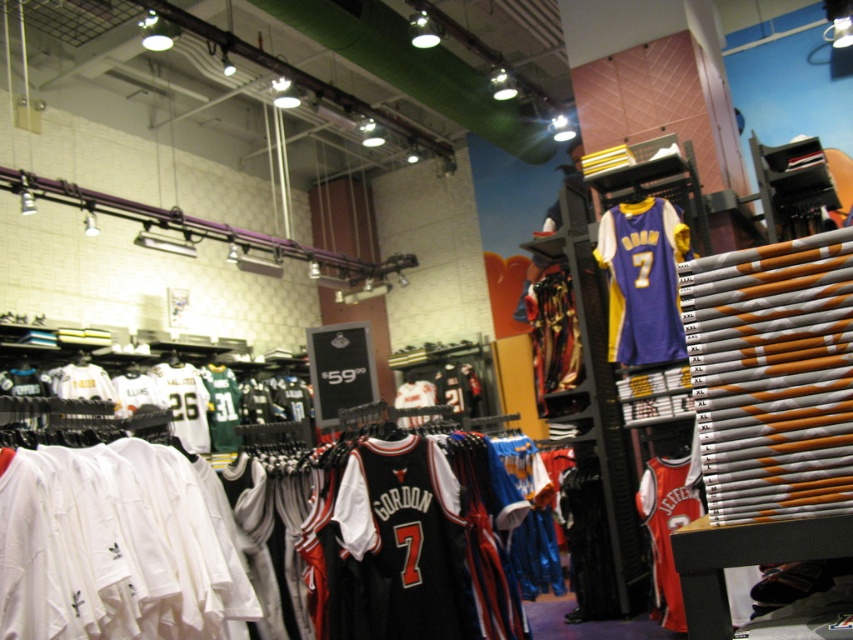
Does point (393, 442) come farther from viewer compared to point (698, 515)?

No, it is not.

Can you confirm if black jersey at center is bigger than red jersey at center?

Actually, black jersey at center might be smaller than red jersey at center.

Locate an element on the screen. black jersey at center is located at coordinates (405, 540).

Who is taller, purple jersey at center or red jersey at center?

With more height is purple jersey at center.

Who is more forward, (619, 333) or (668, 614)?

Point (668, 614)

Locate an element on the screen. The image size is (853, 640). purple jersey at center is located at coordinates (642, 280).

Identify the location of purple jersey at center. (642, 280).

Is black jersey at center smaller than purple jersey at center?

Yes.

Is black jersey at center to the right of purple jersey at center from the viewer's perspective?

In fact, black jersey at center is to the left of purple jersey at center.

Between point (427, 561) and point (625, 225), which one is positioned behind?

The point (625, 225) is behind.

Locate an element on the screen. The width and height of the screenshot is (853, 640). black jersey at center is located at coordinates (405, 540).